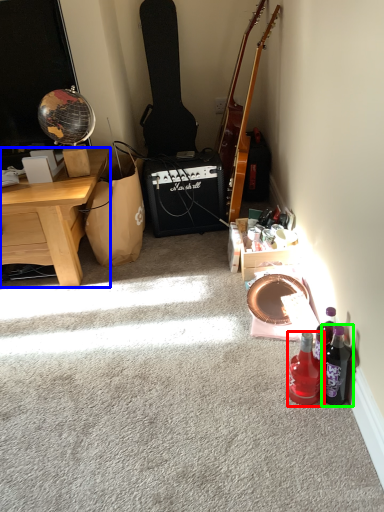
Question: Considering the real-world distances, which object is closest to bottle (highlighted by a red box)? desk (highlighted by a blue box) or bottle (highlighted by a green box).

Choices:
 (A) desk
 (B) bottle

Answer: (B)